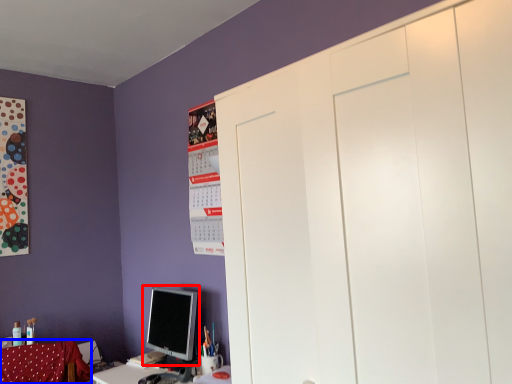
Question: Which of the following is the closest to the observer, computer monitor (highlighted by a red box) or swivel chair (highlighted by a blue box)?

Choices:
 (A) computer monitor
 (B) swivel chair

Answer: (B)